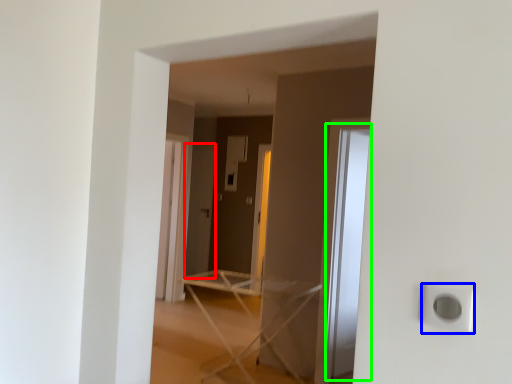
Question: Which object is the closest to the screen door (highlighted by a red box)? Choose among these: electric outlet (highlighted by a blue box) or glass door (highlighted by a green box).

Choices:
 (A) electric outlet
 (B) glass door

Answer: (B)